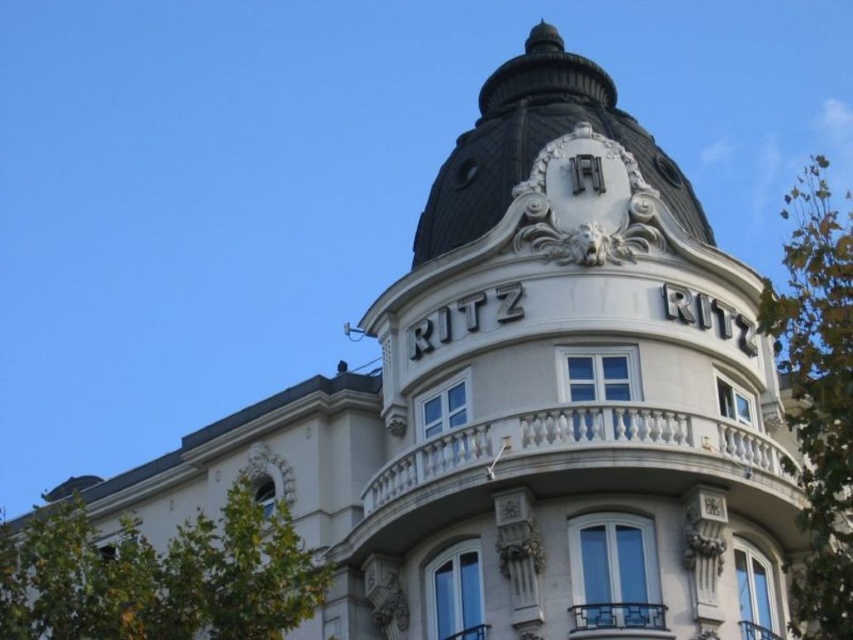
Question: Can you confirm if green leafy tree at lower left is wider than green leafy tree at right?

Choices:
 (A) yes
 (B) no

Answer: (B)

Question: Among these objects, which one is nearest to the camera?

Choices:
 (A) green leafy tree at lower left
 (B) green leafy tree at right

Answer: (B)

Question: Observing the image, what is the correct spatial positioning of green leafy tree at lower left in reference to green leafy tree at right?

Choices:
 (A) above
 (B) below

Answer: (B)

Question: Which point is closer to the camera?

Choices:
 (A) green leafy tree at lower left
 (B) green leafy tree at right

Answer: (B)

Question: Can you confirm if green leafy tree at lower left is positioned to the left of green leafy tree at right?

Choices:
 (A) yes
 (B) no

Answer: (A)

Question: Which point appears closest to the camera in this image?

Choices:
 (A) (32, 598)
 (B) (833, 356)

Answer: (B)